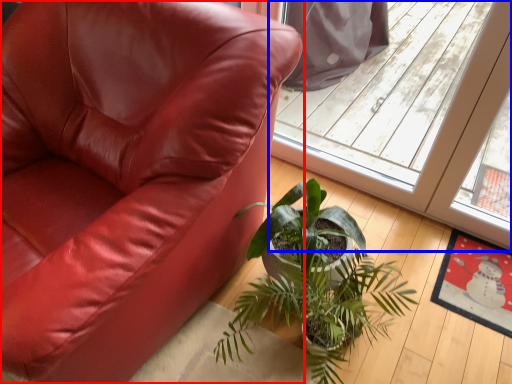
Question: Which of the following is the farthest to the observer, chair (highlighted by a red box) or screen door (highlighted by a blue box)?

Choices:
 (A) chair
 (B) screen door

Answer: (B)